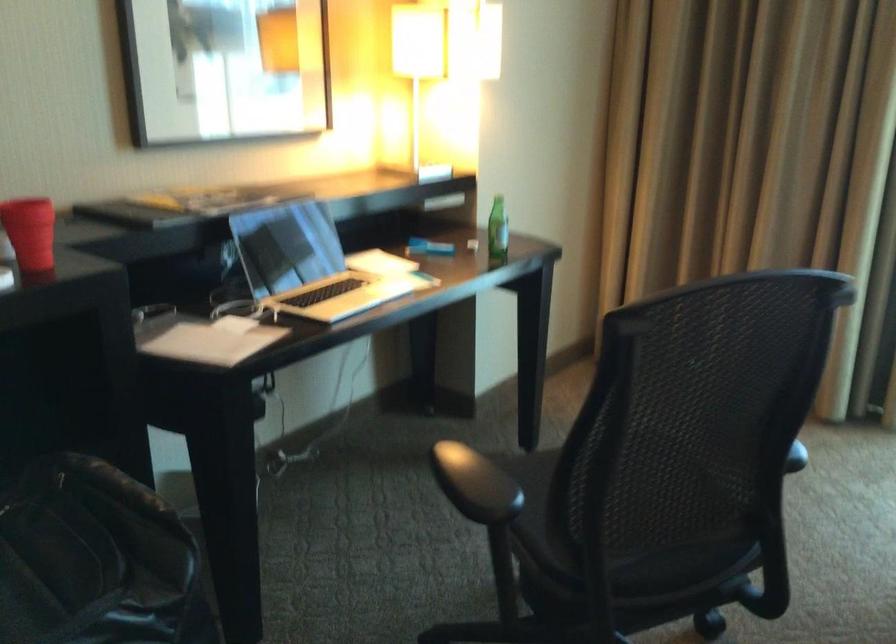
This screenshot has width=896, height=644. Identify the location of laptop display. (280, 254).